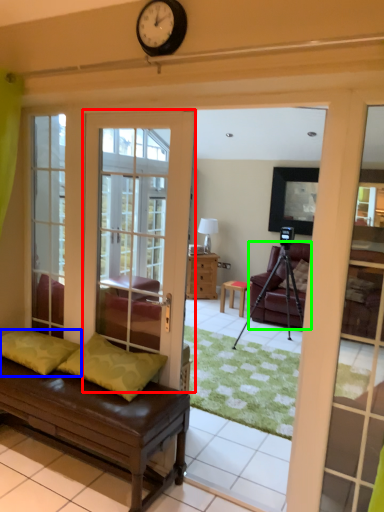
Question: Considering the real-world distances, which object is closest to door (highlighted by a red box)? pillow (highlighted by a blue box) or chair (highlighted by a green box).

Choices:
 (A) pillow
 (B) chair

Answer: (A)